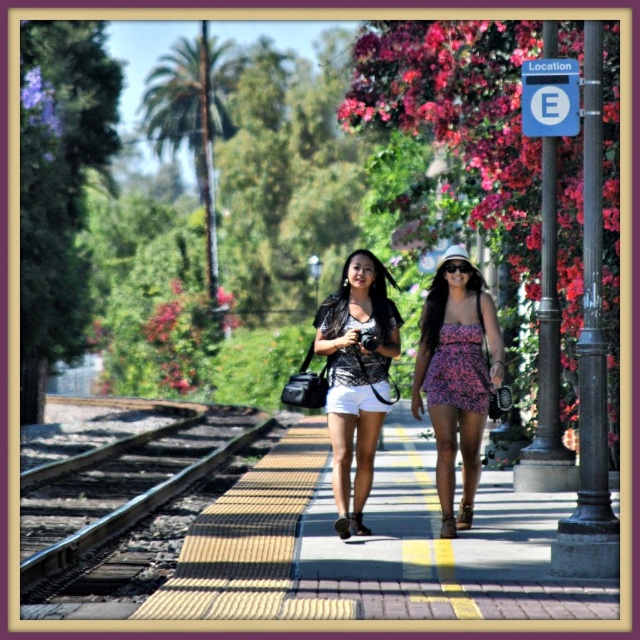
Question: Which object is farther from the camera taking this photo?

Choices:
 (A) floral-patterned dress at center
 (B) matte black camera at center
 (C) floral dress at center

Answer: (C)

Question: Does dark gray metal pole at upper right have a lesser width compared to matte black camera at center?

Choices:
 (A) yes
 (B) no

Answer: (A)

Question: Is dark brown wooden train track at lower left in front of dark gray metal pole at upper right?

Choices:
 (A) no
 (B) yes

Answer: (B)

Question: From the image, what is the correct spatial relationship of floral-patterned dress at center in relation to black metal pole at right?

Choices:
 (A) right
 (B) left

Answer: (B)

Question: Which of the following is the closest to the observer?

Choices:
 (A) (547, 296)
 (B) (243, 445)

Answer: (A)

Question: Which point is farther from the camera taking this photo?

Choices:
 (A) (618, 560)
 (B) (435, 305)
 (C) (545, 390)
 (D) (436, 403)

Answer: (C)